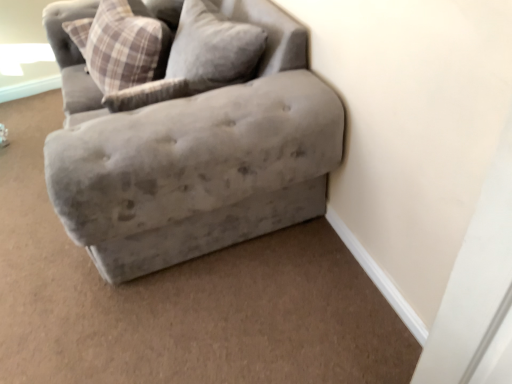
This screenshot has width=512, height=384. Describe the element at coordinates (126, 46) in the screenshot. I see `plaid fabric pillow at upper left` at that location.

Find the location of a particular element. plaid fabric pillow at upper left is located at coordinates (126, 46).

Measure the distance between velvet gray couch at upper right and camera.

The depth of velvet gray couch at upper right is 1.17 meters.

You are a GUI agent. You are given a task and a screenshot of the screen. Output one action in this format:
    pyautogui.click(x=<x>, y=<y>)
    Task: Click on the velvet gray couch at upper right
    The height and width of the screenshot is (384, 512).
    Given the screenshot: What is the action you would take?
    pyautogui.click(x=192, y=154)

Describe the element at coordinates (192, 154) in the screenshot. I see `velvet gray couch at upper right` at that location.

You are a GUI agent. You are given a task and a screenshot of the screen. Output one action in this format:
    pyautogui.click(x=<x>, y=<y>)
    Task: Click on the plaid fabric pillow at upper left
    
    Given the screenshot: What is the action you would take?
    pyautogui.click(x=126, y=46)

Consider the image. Which object is positioned more to the left, plaid fabric pillow at upper left or velvet gray couch at upper right?

plaid fabric pillow at upper left is more to the left.

Considering their positions, is plaid fabric pillow at upper left located in front of or behind velvet gray couch at upper right?

Visually, plaid fabric pillow at upper left is located behind velvet gray couch at upper right.

Considering the points (146, 72) and (117, 247), which point is behind, point (146, 72) or point (117, 247)?

The point (146, 72) is behind.

From the image's perspective, is plaid fabric pillow at upper left on velvet gray couch at upper right?

Yes, from the image's perspective, plaid fabric pillow at upper left is above velvet gray couch at upper right.

From a real-world perspective, which object rests below the other?

velvet gray couch at upper right, from a real-world perspective.

Can you confirm if plaid fabric pillow at upper left is thinner than velvet gray couch at upper right?

Yes, plaid fabric pillow at upper left is thinner than velvet gray couch at upper right.

Is plaid fabric pillow at upper left shorter than velvet gray couch at upper right?

Indeed, plaid fabric pillow at upper left has a lesser height compared to velvet gray couch at upper right.

In the scene shown: Which of these two, plaid fabric pillow at upper left or velvet gray couch at upper right, is smaller?

Smaller between the two is plaid fabric pillow at upper left.

Is plaid fabric pillow at upper left located outside velvet gray couch at upper right?

No, plaid fabric pillow at upper left is not entirely external to velvet gray couch at upper right.

Is plaid fabric pillow at upper left in contact with velvet gray couch at upper right?

plaid fabric pillow at upper left and velvet gray couch at upper right are not in contact.

Is plaid fabric pillow at upper left facing towards velvet gray couch at upper right?

Yes, plaid fabric pillow at upper left is aimed at velvet gray couch at upper right.

How different are the orientations of plaid fabric pillow at upper left and velvet gray couch at upper right in degrees?

3.6 degrees separate the facing orientations of plaid fabric pillow at upper left and velvet gray couch at upper right.

How much distance is there between plaid fabric pillow at upper left and velvet gray couch at upper right?

The distance of plaid fabric pillow at upper left from velvet gray couch at upper right is 52.60 centimeters.

The width and height of the screenshot is (512, 384). Identify the location of studio couch that is under the plaid fabric pillow at upper left (from a real-world perspective). (192, 154).

Considering the positions of objects velvet gray couch at upper right and plaid fabric pillow at upper left in the image provided, who is more to the left, velvet gray couch at upper right or plaid fabric pillow at upper left?

Positioned to the left is plaid fabric pillow at upper left.

Is velvet gray couch at upper right positioned behind plaid fabric pillow at upper left?

No, velvet gray couch at upper right is closer to the viewer.

Which is in front, point (246, 234) or point (126, 76)?

Positioned in front is point (246, 234).

From the image's perspective, which is above, velvet gray couch at upper right or plaid fabric pillow at upper left?

From the image's view, plaid fabric pillow at upper left is above.

From a real-world perspective, is velvet gray couch at upper right physically below plaid fabric pillow at upper left?

Yes, from a real-world perspective, velvet gray couch at upper right is beneath plaid fabric pillow at upper left.

Which of these two, velvet gray couch at upper right or plaid fabric pillow at upper left, is thinner?

plaid fabric pillow at upper left.

Is velvet gray couch at upper right shorter than plaid fabric pillow at upper left?

No, velvet gray couch at upper right is not shorter than plaid fabric pillow at upper left.

Considering the sizes of objects velvet gray couch at upper right and plaid fabric pillow at upper left in the image provided, who is smaller, velvet gray couch at upper right or plaid fabric pillow at upper left?

With smaller size is plaid fabric pillow at upper left.

Is plaid fabric pillow at upper left completely or partially inside velvet gray couch at upper right?

Indeed, plaid fabric pillow at upper left is located within velvet gray couch at upper right.

Is velvet gray couch at upper right touching plaid fabric pillow at upper left?

velvet gray couch at upper right is not next to plaid fabric pillow at upper left, and they're not touching.

Could you tell me if velvet gray couch at upper right is facing plaid fabric pillow at upper left?

Yes, velvet gray couch at upper right is oriented towards plaid fabric pillow at upper left.

What's the angular difference between velvet gray couch at upper right and plaid fabric pillow at upper left's facing directions?

There is a 3.6-degree angle between the facing directions of velvet gray couch at upper right and plaid fabric pillow at upper left.

Measure the distance from velvet gray couch at upper right to plaid fabric pillow at upper left.

They are 20.71 inches apart.

This screenshot has height=384, width=512. What are the coordinates of `studio couch in front of the plaid fabric pillow at upper left` in the screenshot? It's located at (192, 154).

This screenshot has height=384, width=512. I want to click on studio couch below the plaid fabric pillow at upper left (from the image's perspective), so click(x=192, y=154).

This screenshot has width=512, height=384. Find the location of `pillow above the velvet gray couch at upper right (from a real-world perspective)`. pillow above the velvet gray couch at upper right (from a real-world perspective) is located at coordinates (126, 46).